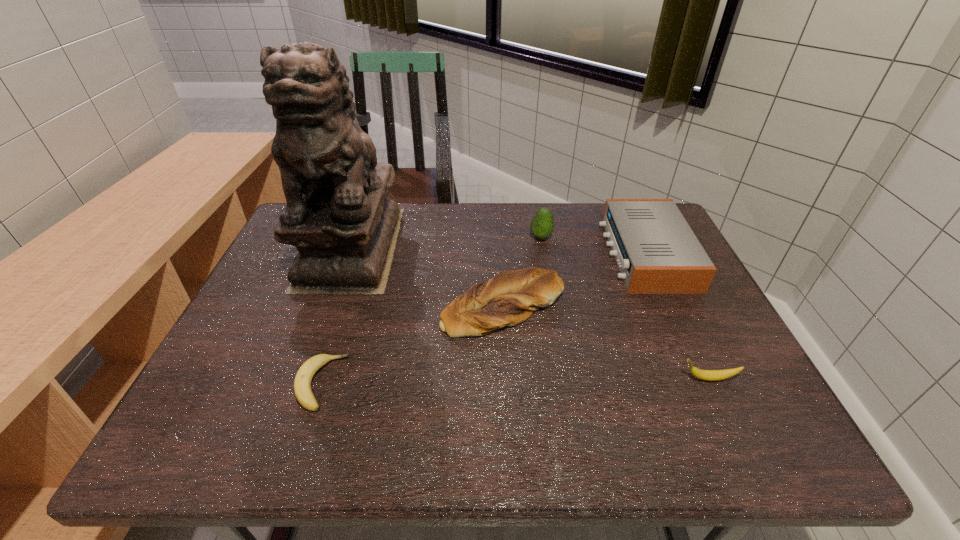
Where is `free spot at the near right corner of the desktop`? The image size is (960, 540). free spot at the near right corner of the desktop is located at coordinates (768, 440).

The width and height of the screenshot is (960, 540). In order to click on vacant space in between the tallest object and the avocado in this screenshot , I will do `click(446, 242)`.

This screenshot has height=540, width=960. I want to click on free point between the second shortest object and the shortest object, so click(515, 381).

Where is `vacant region between the second shortest object and the radio receiver`? Image resolution: width=960 pixels, height=540 pixels. vacant region between the second shortest object and the radio receiver is located at coordinates (677, 316).

You are a GUI agent. You are given a task and a screenshot of the screen. Output one action in this format:
    pyautogui.click(x=<x>, y=<y>)
    Task: Click on the empty location between the avocado and the fourth shortest object
    The height and width of the screenshot is (540, 960).
    Given the screenshot: What is the action you would take?
    pyautogui.click(x=593, y=246)

This screenshot has width=960, height=540. In order to click on unoccupied area between the sculpture and the radio receiver in this screenshot , I will do `click(498, 251)`.

The image size is (960, 540). I want to click on free space that is in between the third tallest object and the avocado, so click(593, 246).

You are a GUI agent. You are given a task and a screenshot of the screen. Output one action in this format:
    pyautogui.click(x=<x>, y=<y>)
    Task: Click on the vacant area that lies between the bread and the shortest object
    The image size is (960, 540).
    Given the screenshot: What is the action you would take?
    pyautogui.click(x=412, y=345)

Locate which object is the fifth closest to the bread. Please provide its 2D coordinates. Your answer should be formatted as a tuple, i.e. [(x, y)], where the tuple contains the x and y coordinates of a point satisfying the conditions above.

[(708, 375)]

Where is `the closest object to the bread`? Image resolution: width=960 pixels, height=540 pixels. the closest object to the bread is located at coordinates (338, 215).